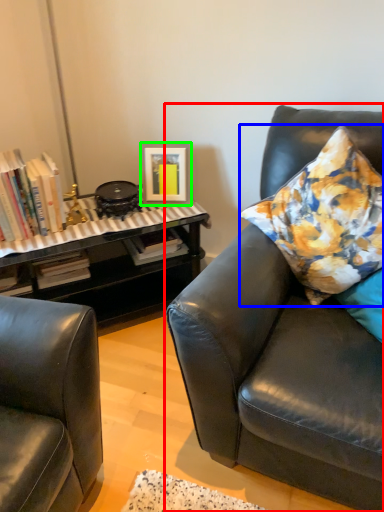
Question: Which is farther away from studio couch (highlighted by a red box)? pillow (highlighted by a blue box) or picture frame (highlighted by a green box)?

Choices:
 (A) pillow
 (B) picture frame

Answer: (B)